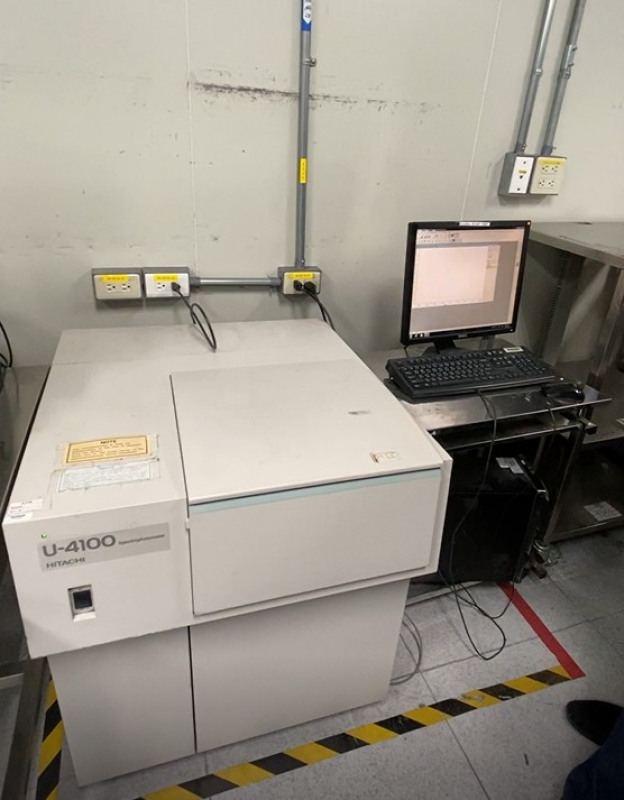
Locate an element on the screen. The image size is (624, 800). electrical cords is located at coordinates (198, 318), (316, 298), (329, 326), (494, 409), (512, 602), (414, 664).